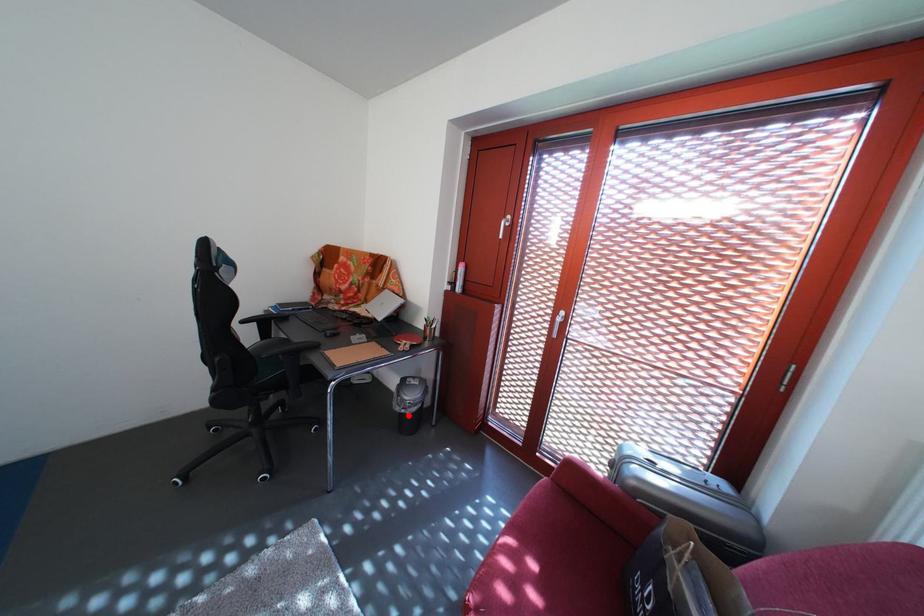
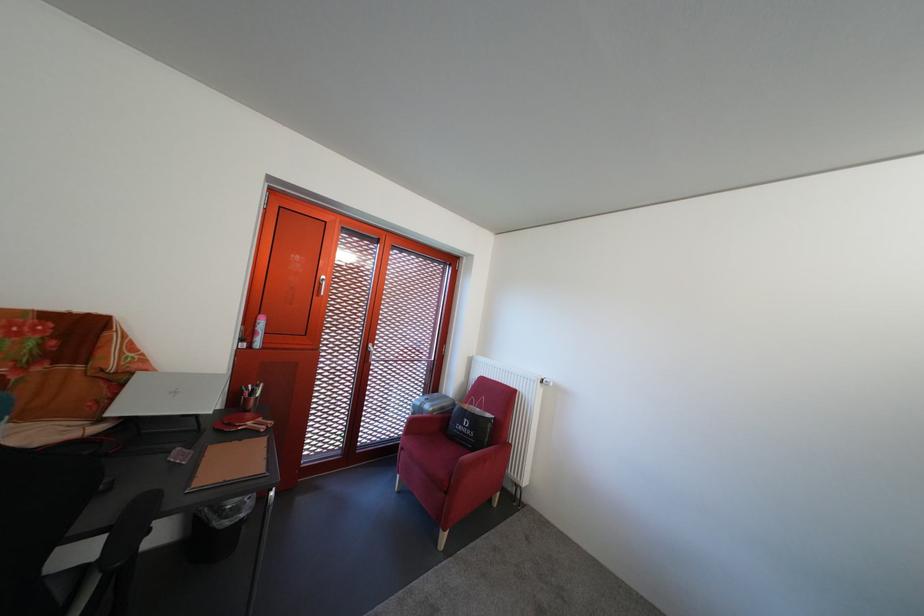
Question: I am providing you with two images of the same scene from different viewpoints. Given a red point in image1, look at the same physical point in image2. Is it:

Choices:
 (A) Closer to the viewpoint
 (B) Farther from the viewpoint

Answer: (A)